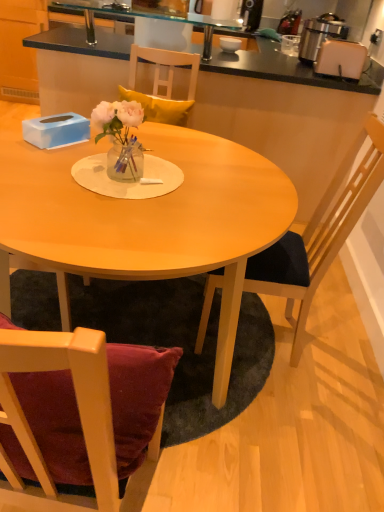
Question: From the image's perspective, is white plastic toaster at upper right above or below metallic silver toaster at upper right?

Choices:
 (A) above
 (B) below

Answer: (B)

Question: Based on their positions, is white plastic toaster at upper right located to the left or right of metallic silver toaster at upper right?

Choices:
 (A) right
 (B) left

Answer: (B)

Question: Which is nearer to the wooden table at center?

Choices:
 (A) black laminate cabinet at upper left
 (B) metallic silver toaster at upper right
 (C) wooden chair at right
 (D) clear glass vase at center
 (E) matte wood table at center

Answer: (B)

Question: Which object is positioned closest to the transparent glass sink at upper center?

Choices:
 (A) white plastic toaster at upper right
 (B) wooden chair at right
 (C) clear glass vase at center
 (D) wooden table at center
 (E) white glossy bowl at upper center

Answer: (E)